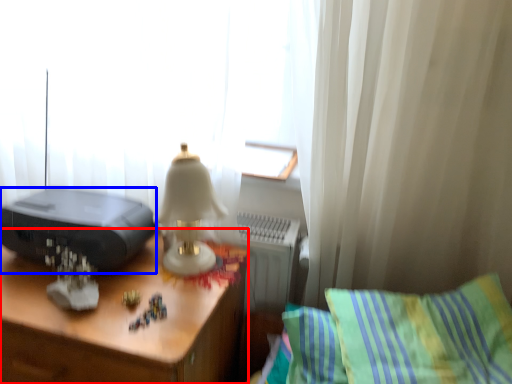
Question: Among these objects, which one is nearest to the camera, desk (highlighted by a red box) or printer (highlighted by a blue box)?

Choices:
 (A) desk
 (B) printer

Answer: (A)